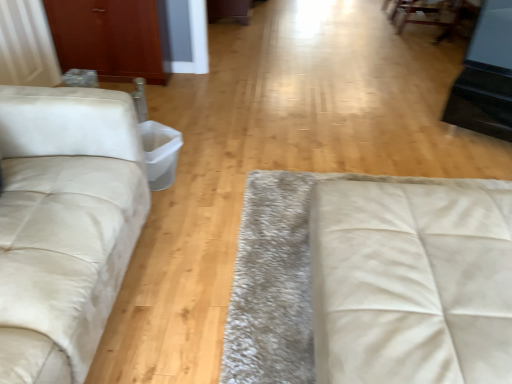
Locate an element on the screen. The width and height of the screenshot is (512, 384). vacant point above white leather studio couch at center, acting as the second studio couch starting from the left (from a real-world perspective) is located at coordinates (443, 280).